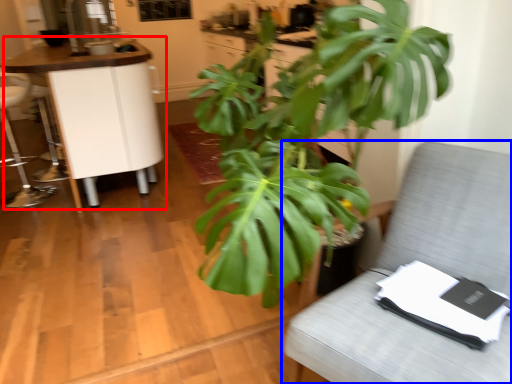
Question: Which object is closer to the camera taking this photo, table (highlighted by a red box) or furniture (highlighted by a blue box)?

Choices:
 (A) table
 (B) furniture

Answer: (B)